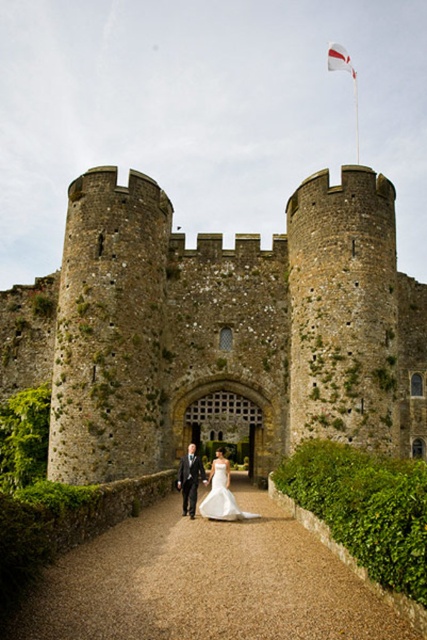
You are a bird flying over the medieval castle scene. You want to land on the highest point available. Which object should you choose between the stone textured castle at center and the white fabric flag at upper center?

The stone textured castle at center is taller than the white fabric flag at upper center, so the highest point available is the stone textured castle at center.